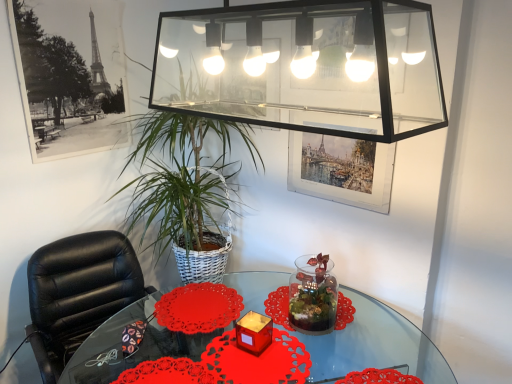
Where is `free spot to the right of translucent glass candle at center`? This screenshot has height=384, width=512. free spot to the right of translucent glass candle at center is located at coordinates (285, 350).